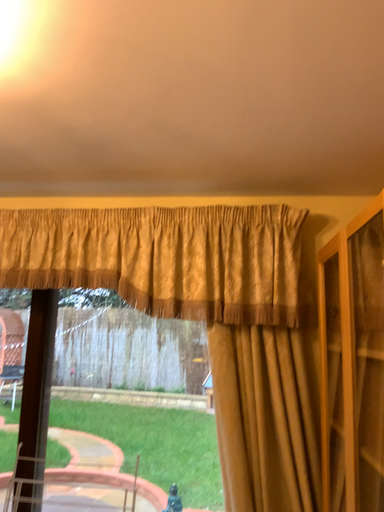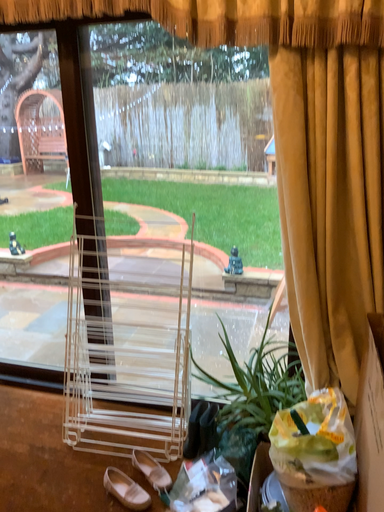
Question: Which way did the camera rotate in the video?

Choices:
 (A) rotated right
 (B) rotated left

Answer: (B)